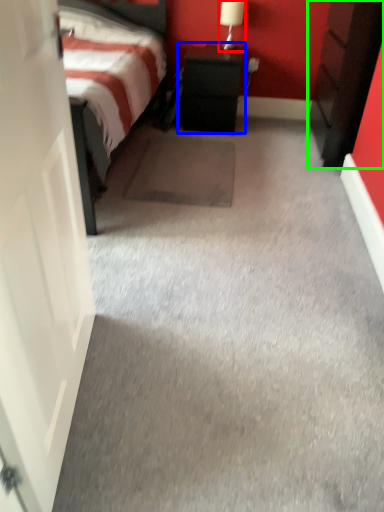
Question: Considering the real-world distances, which object is farthest from table lamp (highlighted by a red box)? nightstand (highlighted by a blue box) or nightstand (highlighted by a green box)?

Choices:
 (A) nightstand
 (B) nightstand

Answer: (B)